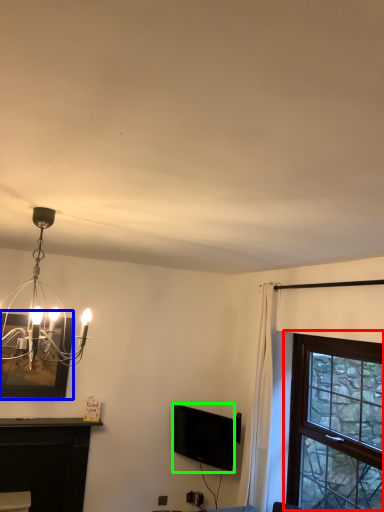
Question: Based on their relative distances, which object is nearer to window (highlighted by a red box)? Choose from picture frame (highlighted by a blue box) and television (highlighted by a green box).

Choices:
 (A) picture frame
 (B) television

Answer: (B)